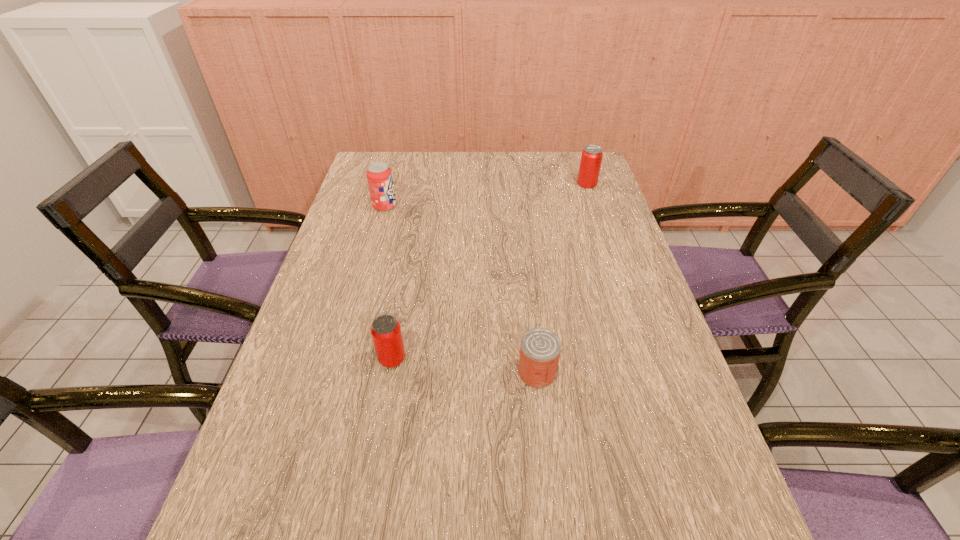
At what (x,y) coordinates should I click in order to perform the action: click on can that can be found as the second closest to the leftmost object. Please return your answer as a coordinate pair (x, y). Looking at the image, I should click on (591, 158).

Identify which can is the third nearest to the third nearest object. Please provide its 2D coordinates. Your answer should be formatted as a tuple, i.e. [(x, y)], where the tuple contains the x and y coordinates of a point satisfying the conditions above.

[(540, 348)]

Where is `free point that satisfies the following two spatial constraints: 1. on the front side of the leftmost can; 2. on the right side of the second can from left to right`? The width and height of the screenshot is (960, 540). free point that satisfies the following two spatial constraints: 1. on the front side of the leftmost can; 2. on the right side of the second can from left to right is located at coordinates (390, 373).

Locate an element on the screen. The image size is (960, 540). vacant position in the image that satisfies the following two spatial constraints: 1. on the surface of the shortest object; 2. on the right side of the soda can is located at coordinates coord(338,373).

I want to click on free space that satisfies the following two spatial constraints: 1. on the front side of the rightmost object; 2. on the surface of the leftmost object, so click(594, 206).

Find the location of a particular element. Image resolution: width=960 pixels, height=540 pixels. vacant space that satisfies the following two spatial constraints: 1. on the surface of the leftmost can; 2. on the right side of the leftmost object is located at coordinates (342, 359).

Locate an element on the screen. blank area in the image that satisfies the following two spatial constraints: 1. on the front side of the rightmost can; 2. on the surface of the soda can is located at coordinates (594, 206).